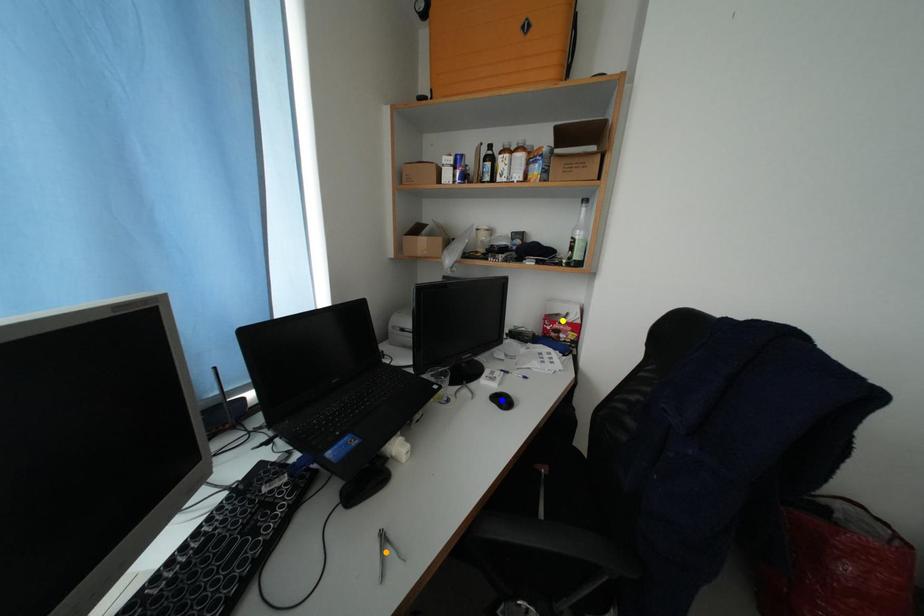
Order these from nearest to farthest:
orange point | blue point | yellow point

orange point
blue point
yellow point